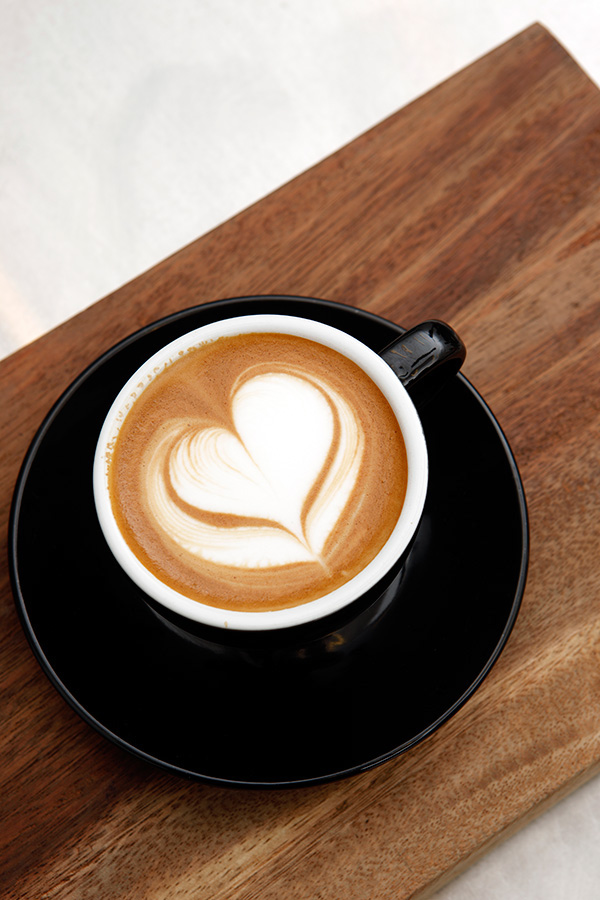
Identify the location of saucer. Image resolution: width=600 pixels, height=900 pixels. point(371,744).